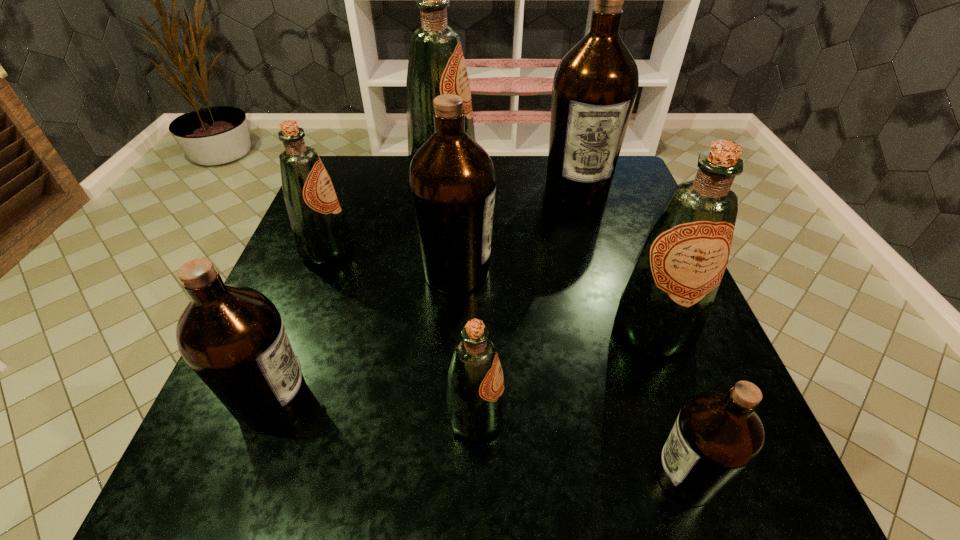
Find the location of `the farthest green olive oil`. the farthest green olive oil is located at coordinates (436, 66).

The width and height of the screenshot is (960, 540). I want to click on the farthest brown olive oil, so click(595, 85).

This screenshot has width=960, height=540. I want to click on the second biggest brown olive oil, so [452, 182].

Find the location of a particular element. This screenshot has height=540, width=960. the second farthest brown olive oil is located at coordinates (452, 182).

Identify the location of the rightmost green olive oil. (664, 305).

Locate an element on the screen. The width and height of the screenshot is (960, 540). the second biggest green olive oil is located at coordinates (664, 305).

At what (x,y) coordinates should I click in order to perform the action: click on the leftmost green olive oil. Please return your answer as a coordinate pair (x, y). This screenshot has height=540, width=960. Looking at the image, I should click on (321, 234).

Where is `the third biggest green olive oil`? This screenshot has width=960, height=540. the third biggest green olive oil is located at coordinates (321, 234).

At what (x,y) coordinates should I click in order to perform the action: click on the second nearest brown olive oil. Please return your answer as a coordinate pair (x, y). The width and height of the screenshot is (960, 540). Looking at the image, I should click on (233, 337).

This screenshot has height=540, width=960. I want to click on the leftmost brown olive oil, so click(233, 337).